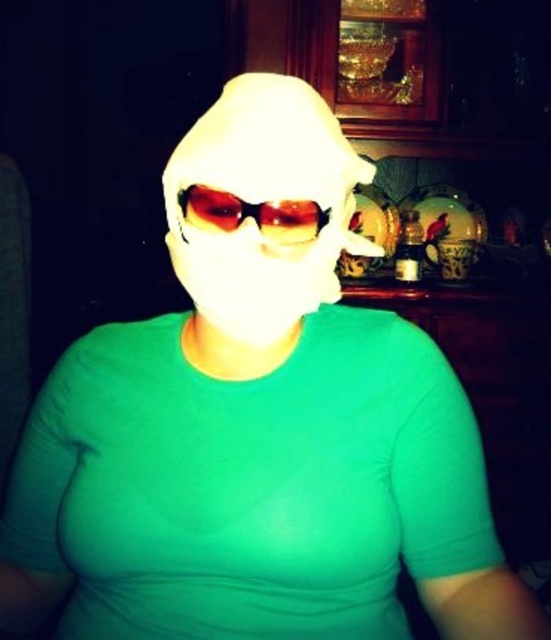
Question: Considering the relative positions of white matte mask at center and translucent amber lens goggles at center in the image provided, where is white matte mask at center located with respect to translucent amber lens goggles at center?

Choices:
 (A) below
 (B) above

Answer: (B)

Question: Which object is closer to the camera taking this photo?

Choices:
 (A) white matte mask at center
 (B) translucent amber lens goggles at center

Answer: (A)

Question: Can you confirm if white matte mask at center is smaller than translucent amber lens goggles at center?

Choices:
 (A) yes
 (B) no

Answer: (B)

Question: From the image, what is the correct spatial relationship of white matte mask at center in relation to translucent amber lens goggles at center?

Choices:
 (A) above
 (B) below

Answer: (A)